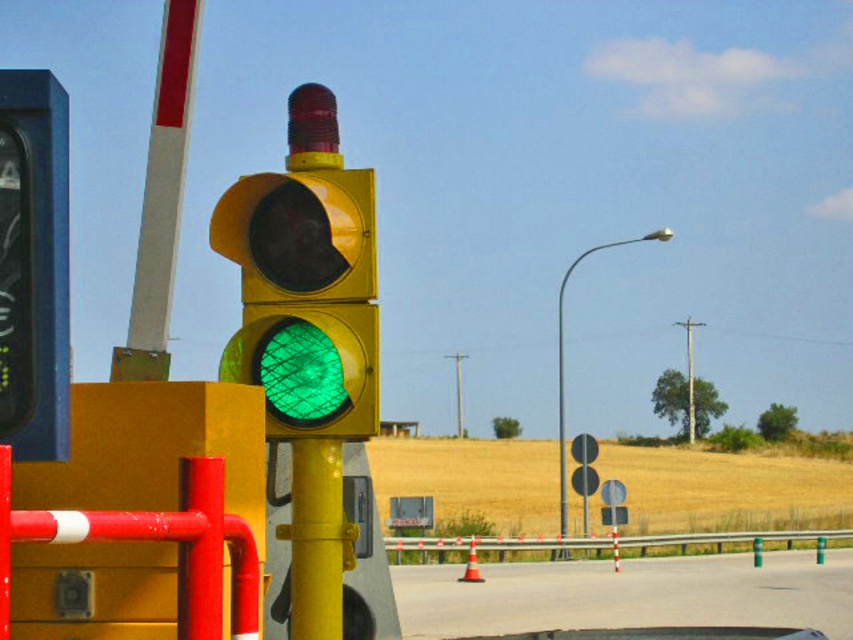
You are a pedestrian standing at the railway crossing and want to reach the point at coordinates point (260, 273) and point (204, 628). Which point is closer to you?

Point (260, 273) is closer to you because it is further to the viewer than point (204, 628).